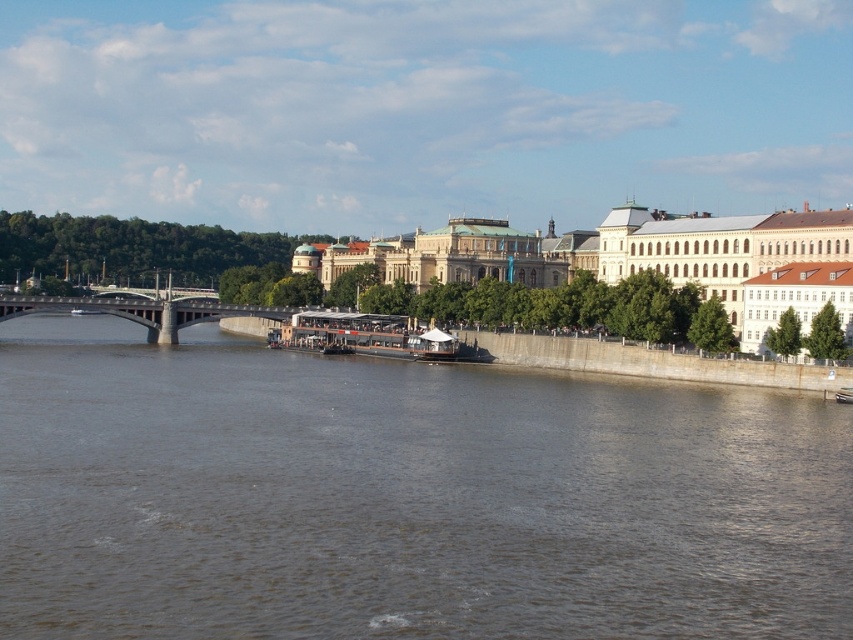
You are a photographer standing at the riverside and want to capture both the point at coordinates point (227, 554) and point (303, 314) in your shot. Which point will appear larger in your photo?

Point (227, 554) is closer to the camera than point (303, 314), so it will appear larger in the photo.

You are a tourist standing on the riverside and want to take a photo of the wooden polished boat at center and the concrete bridge at left. Which object should you focus on first to ensure both are in the frame?

The wooden polished boat at center is in front of the concrete bridge at left, so you should focus on the wooden polished boat at center first to ensure both are in the frame.

You are a tourist standing on the riverside path. You want to take a photo of the brown water at center and the concrete bridge at left. Which object should you focus on first to ensure both are in the frame?

You should focus on the concrete bridge at left first because the brown water at center is in front of it, so adjusting the frame to include the closer brown water at center will naturally include the farther concrete bridge at left.